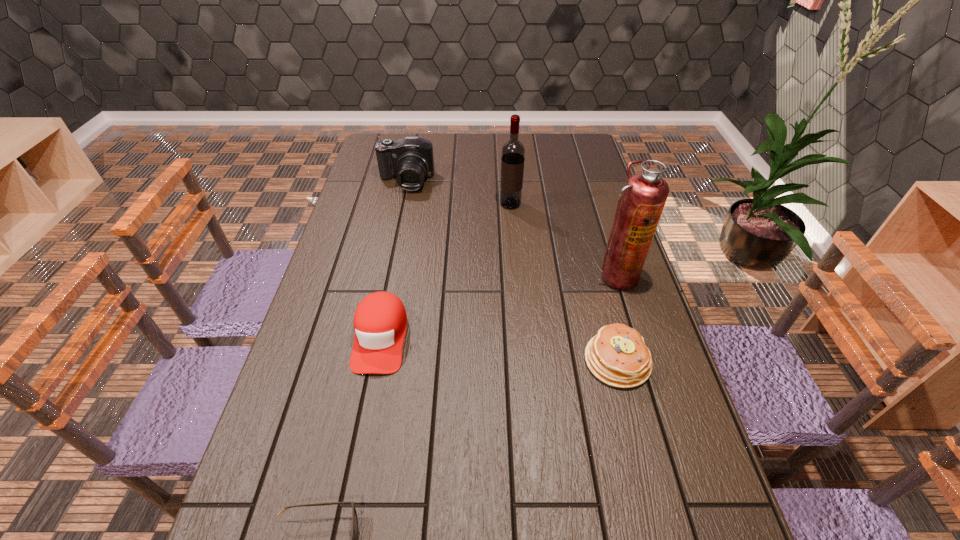
Where is `vacant space located 0.270m on the front-facing side of the baseball cap`? This screenshot has height=540, width=960. vacant space located 0.270m on the front-facing side of the baseball cap is located at coordinates (x=348, y=496).

Where is `free region located 0.210m on the front of the pancake`? The width and height of the screenshot is (960, 540). free region located 0.210m on the front of the pancake is located at coordinates (649, 484).

Where is `camera positioned at the left edge`? This screenshot has height=540, width=960. camera positioned at the left edge is located at coordinates (410, 159).

This screenshot has width=960, height=540. What are the coordinates of `baseball cap at the left edge` in the screenshot? It's located at (380, 321).

Identify the location of fire extinguisher that is at the right edge. (645, 194).

In order to click on pancake that is at the right edge in this screenshot , I will do `click(617, 355)`.

Where is `vacant area at the far edge of the desktop`? The image size is (960, 540). vacant area at the far edge of the desktop is located at coordinates (468, 143).

Where is `free space at the left edge`? The height and width of the screenshot is (540, 960). free space at the left edge is located at coordinates (348, 344).

In the image, there is a desktop. At what (x,y) coordinates should I click in order to perform the action: click on blank space at the right edge. Please return your answer as a coordinate pair (x, y). Image resolution: width=960 pixels, height=540 pixels. Looking at the image, I should click on (690, 447).

Where is `vacant space at the far right corner`? The height and width of the screenshot is (540, 960). vacant space at the far right corner is located at coordinates (567, 147).